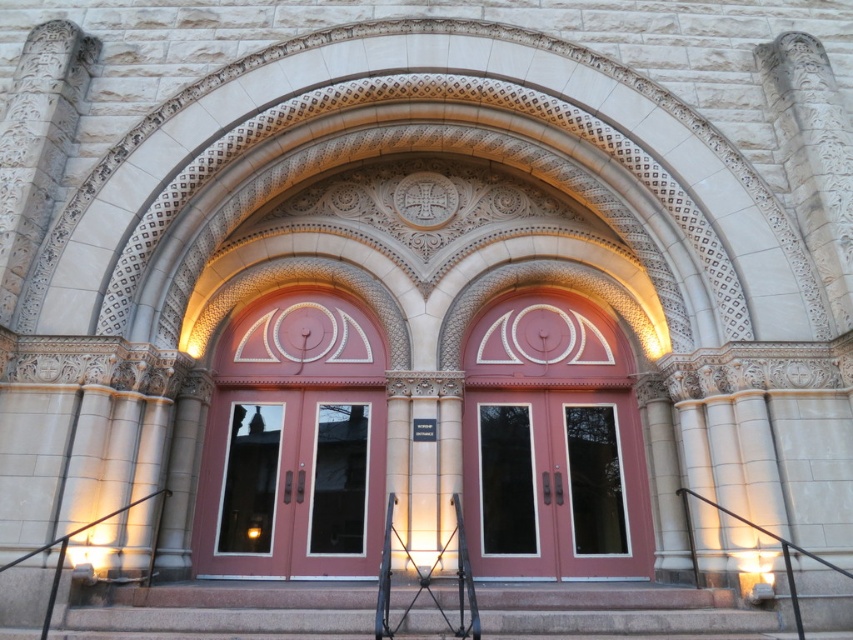
Is matte glass doors at center positioned at the back of matte wood doors at center?

No, it is not.

From the picture: Can you confirm if matte glass doors at center is positioned below matte wood doors at center?

Actually, matte glass doors at center is above matte wood doors at center.

Does point (207, 417) lie behind point (527, 520)?

That is True.

The height and width of the screenshot is (640, 853). I want to click on matte glass doors at center, so click(x=291, y=484).

Which is in front, point (560, 468) or point (363, 611)?

Point (363, 611) is in front.

At what (x,y) coordinates should I click in order to perform the action: click on matte wood doors at center. Please return your answer as a coordinate pair (x, y). Looking at the image, I should click on (555, 484).

Find the location of a particular element. This screenshot has width=853, height=640. matte wood doors at center is located at coordinates (555, 484).

The image size is (853, 640). Identify the location of matte wood doors at center. (555, 484).

Who is more distant from viewer, (280, 476) or (653, 588)?

Positioned behind is point (280, 476).

Who is lower down, matte glass doors at center or granite steps at center?

granite steps at center

Which is behind, point (228, 401) or point (688, 609)?

Point (228, 401)

Identify the location of matte glass doors at center. The height and width of the screenshot is (640, 853). (291, 484).